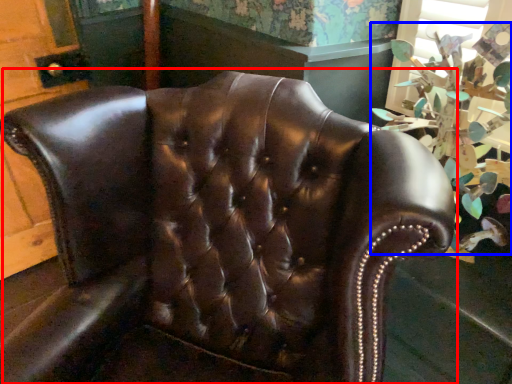
Question: Which point is closer to the camera, chair (highlighted by a red box) or floral arrangement (highlighted by a blue box)?

Choices:
 (A) chair
 (B) floral arrangement

Answer: (A)